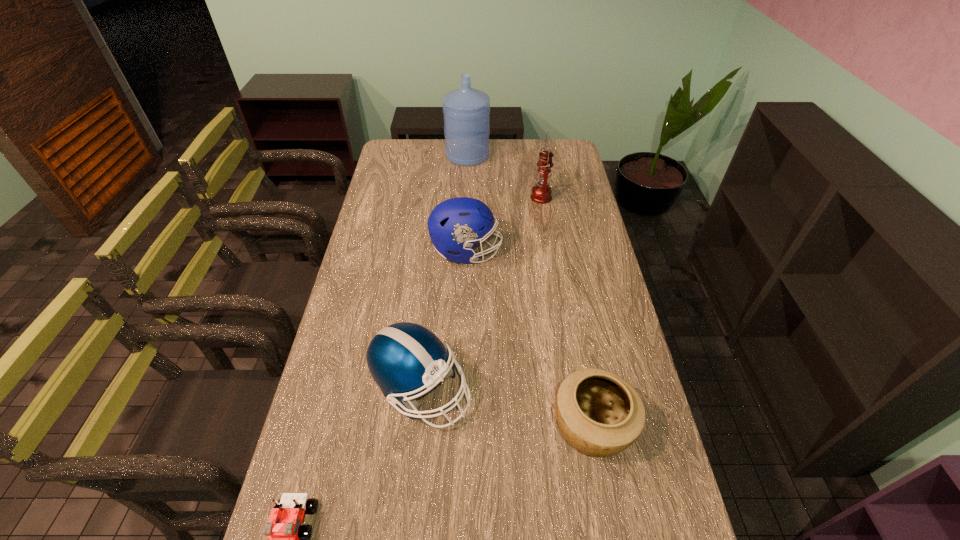
Where is `vacant space at the far right corner of the desktop`? vacant space at the far right corner of the desktop is located at coordinates (564, 164).

This screenshot has width=960, height=540. Identify the location of empty space that is in between the oil lamp and the fourth nearest object. (504, 225).

At what (x,y) coordinates should I click in order to perform the action: click on free space between the nearer football helmet and the second farthest object. Please return your answer as a coordinate pair (x, y). Looking at the image, I should click on coord(481,294).

Locate an element on the screen. vacant area that lies between the farther football helmet and the pottery is located at coordinates (529, 340).

Image resolution: width=960 pixels, height=540 pixels. Identify the location of empty location between the oil lamp and the water jug. (504, 177).

I want to click on free space between the nearer football helmet and the water jug, so click(x=444, y=273).

The height and width of the screenshot is (540, 960). What are the coordinates of `free space between the tallest object and the oil lamp` in the screenshot? It's located at (504, 177).

Point out which object is positioned as the fifth nearest to the nearer football helmet. Please provide its 2D coordinates. Your answer should be formatted as a tuple, i.e. [(x, y)], where the tuple contains the x and y coordinates of a point satisfying the conditions above.

[(466, 111)]

Select which object appears as the third closest to the pottery. Please provide its 2D coordinates. Your answer should be formatted as a tuple, i.e. [(x, y)], where the tuple contains the x and y coordinates of a point satisfying the conditions above.

[(286, 539)]

At what (x,y) coordinates should I click in order to perform the action: click on vacant position in the image that satisfies the following two spatial constraints: 1. at the front of the nearer football helmet with the faceguard; 2. on the left side of the pottery. Please return your answer as a coordinate pair (x, y). Looking at the image, I should click on (418, 428).